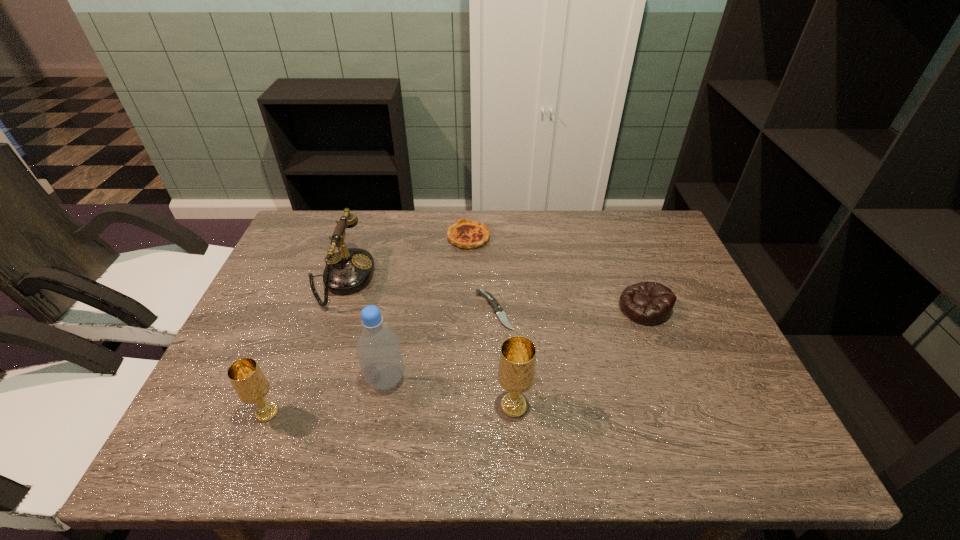
The height and width of the screenshot is (540, 960). Identify the location of free space between the shorter chalice and the right chalice. (390, 409).

Where is `free space between the pocketknife and the third shortest object`? free space between the pocketknife and the third shortest object is located at coordinates (569, 309).

I want to click on vacant area between the third shortest object and the pocketknife, so click(x=569, y=309).

I want to click on vacant space that is in between the shorter chalice and the taller chalice, so click(x=390, y=409).

At what (x,y) coordinates should I click in order to perform the action: click on unoccupied area between the left chalice and the bottle. Please return your answer as a coordinate pair (x, y). Image resolution: width=960 pixels, height=540 pixels. Looking at the image, I should click on (326, 396).

Where is `vacant area between the shorter chalice and the telephone`? The width and height of the screenshot is (960, 540). vacant area between the shorter chalice and the telephone is located at coordinates (303, 346).

Find the location of `free spot between the left chalice and the telephone`. free spot between the left chalice and the telephone is located at coordinates (303, 346).

This screenshot has height=540, width=960. Find the location of `object identified as the second closest to the telephone`. object identified as the second closest to the telephone is located at coordinates (467, 234).

Where is `object that stands as the third closest to the beanbag`? object that stands as the third closest to the beanbag is located at coordinates (467, 234).

At what (x,y) coordinates should I click in order to perform the action: click on vacant space that satisfies the following two spatial constraints: 1. on the dial of the rightmost object; 2. on the left side of the telephone. Please return your answer as a coordinate pair (x, y). Image resolution: width=960 pixels, height=540 pixels. Looking at the image, I should click on (330, 308).